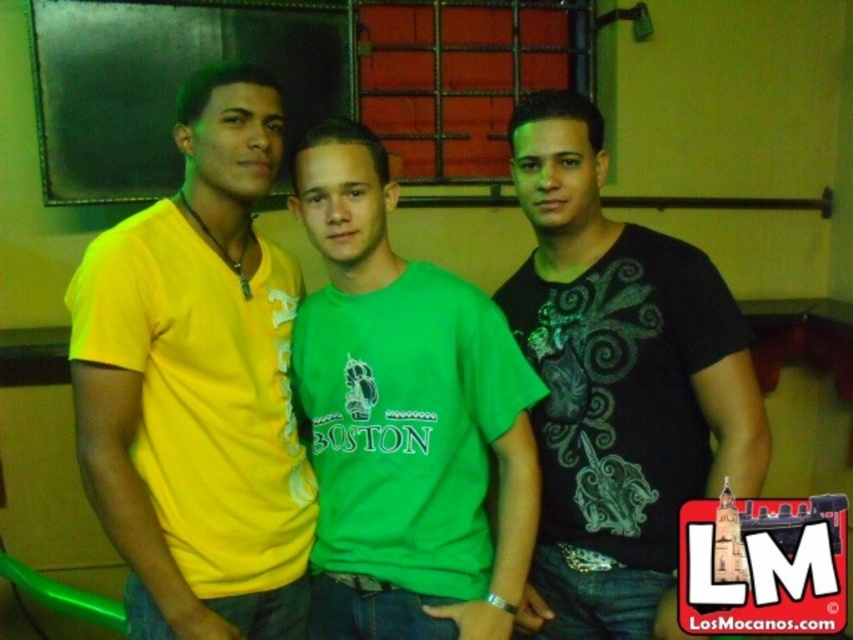
Question: Among these points, which one is nearest to the camera?

Choices:
 (A) (184, 596)
 (B) (601, 301)
 (C) (329, 269)

Answer: (A)

Question: Which point is farther to the camera?

Choices:
 (A) black matte shirt at center
 (B) green cotton t-shirt at center

Answer: (A)

Question: Estimate the real-world distances between objects in this image. Which object is closer to the black matte shirt at center?

Choices:
 (A) yellow matte t-shirt at left
 (B) green cotton t-shirt at center

Answer: (B)

Question: Is black matte shirt at center bigger than green cotton t-shirt at center?

Choices:
 (A) yes
 (B) no

Answer: (A)

Question: Is black matte shirt at center closer to camera compared to green cotton t-shirt at center?

Choices:
 (A) no
 (B) yes

Answer: (A)

Question: Is black matte shirt at center to the right of green cotton t-shirt at center from the viewer's perspective?

Choices:
 (A) no
 (B) yes

Answer: (B)